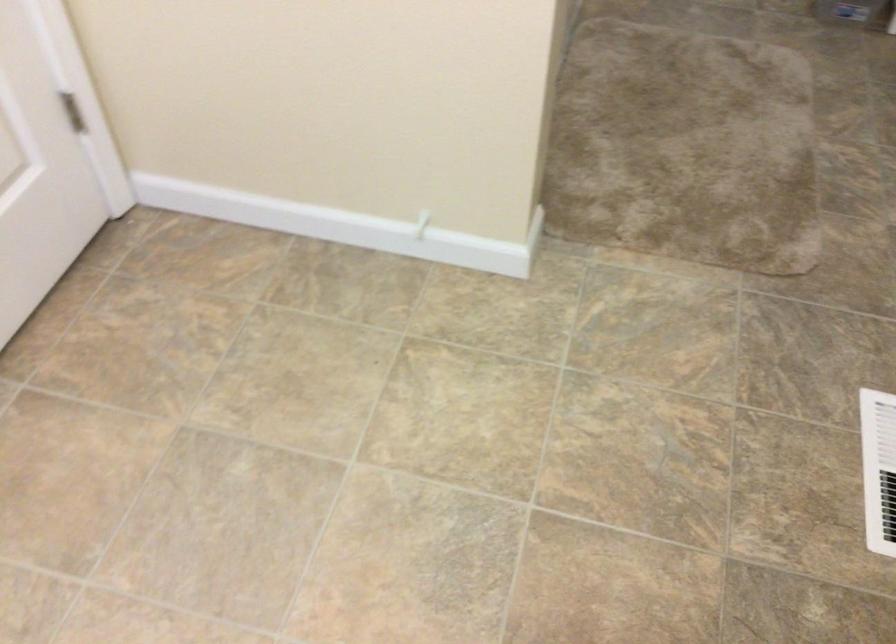
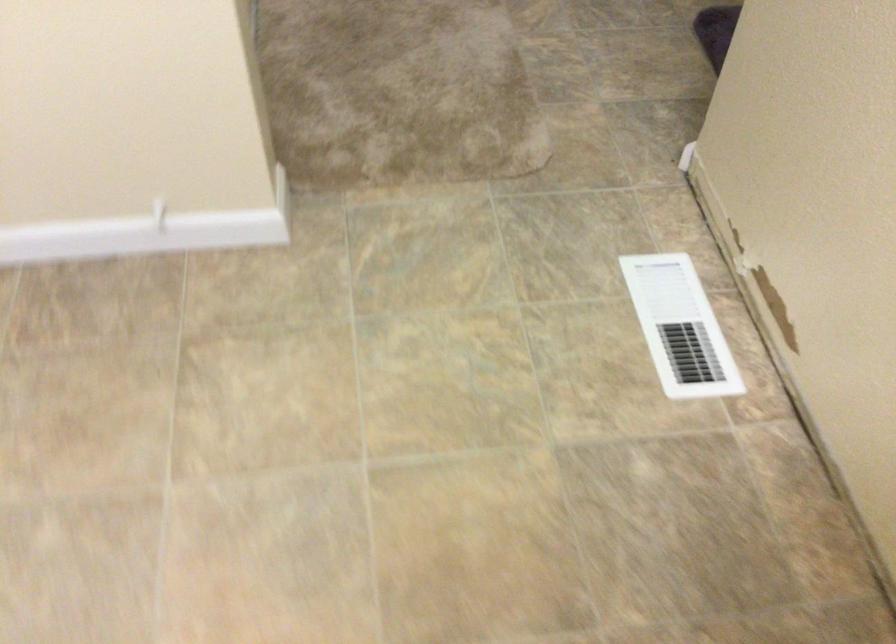
Question: The images are taken continuously from a first-person perspective. In which direction are you moving?

Choices:
 (A) Left
 (B) Right
 (C) Forward
 (D) Backward

Answer: (C)